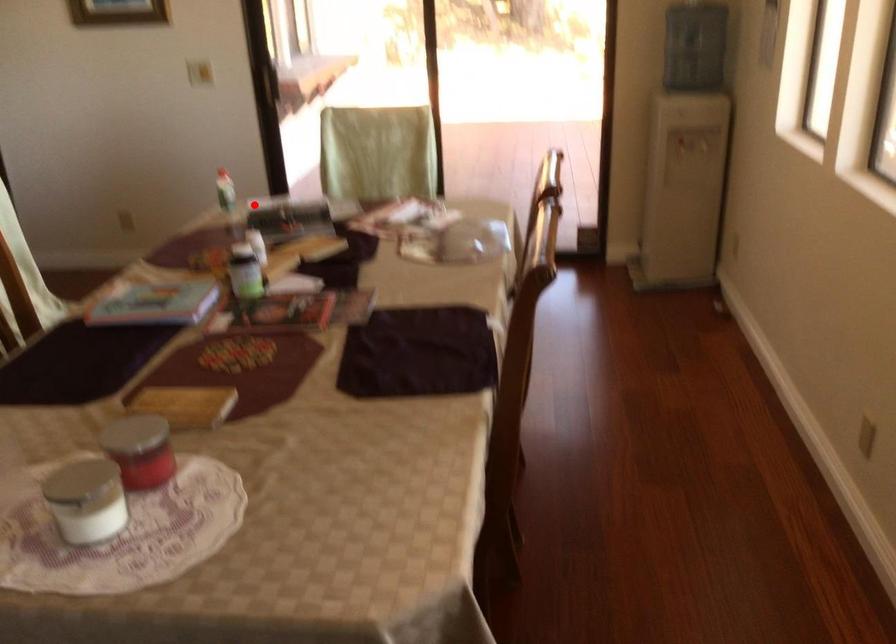
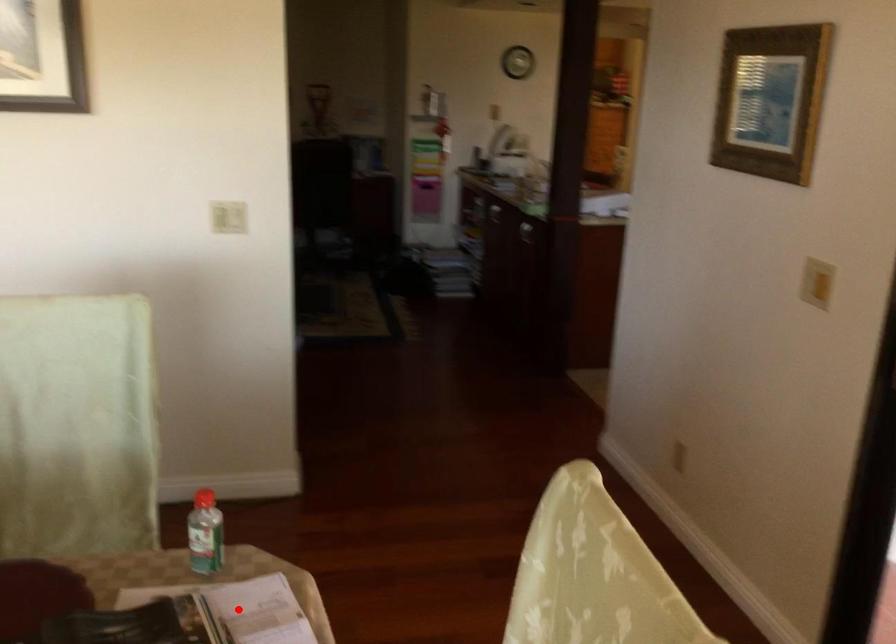
I am providing you with two images of the same scene from different viewpoints. A red point is marked on the first image and another point is marked on the second image. Does the point marked in image1 correspond to the same location as the one in image2?

Yes